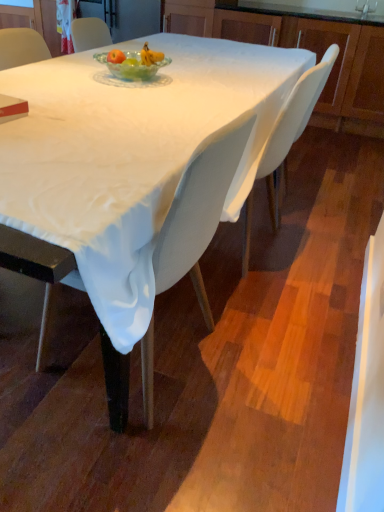
The image size is (384, 512). What are the coordinates of `silver metallic faucet at upper center` in the screenshot? It's located at (365, 8).

What do you see at coordinates (12, 108) in the screenshot?
I see `matte red book at lower left` at bounding box center [12, 108].

What do you see at coordinates (293, 123) in the screenshot? I see `white plastic chair at center, the first chair viewed from the back` at bounding box center [293, 123].

I want to click on translucent glass bowl at center, so click(132, 66).

Locate an element on the screen. The image size is (384, 512). white fabric chair at center, placed as the second chair when sorted from right to left is located at coordinates (197, 215).

You are a GUI agent. You are given a task and a screenshot of the screen. Output one action in this format:
    pyautogui.click(x=<x>, y=<y>)
    Task: Click on the silver metallic faucet at upper center
    This screenshot has height=512, width=384.
    Given the screenshot: What is the action you would take?
    point(365,8)

From the image's perspective, is silver metallic faucet at upper center positioned above or below white fabric table at center?

silver metallic faucet at upper center is above white fabric table at center.

Considering the sizes of objects silver metallic faucet at upper center and white fabric table at center in the image provided, who is smaller, silver metallic faucet at upper center or white fabric table at center?

With smaller size is silver metallic faucet at upper center.

Is silver metallic faucet at upper center next to white fabric table at center?

No, silver metallic faucet at upper center is not beside white fabric table at center.

From a real-world perspective, is silver metallic faucet at upper center beneath white fabric table at center?

Incorrect, from a real-world perspective, silver metallic faucet at upper center is higher than white fabric table at center.

Is translucent glass bowl at center facing away from white plastic chair at center, the second chair when ordered from front to back?

translucent glass bowl at center is not turned away from white plastic chair at center, the second chair when ordered from front to back.

Could you measure the distance between translucent glass bowl at center and white plastic chair at center, the second chair when ordered from front to back?

The distance of translucent glass bowl at center from white plastic chair at center, the second chair when ordered from front to back, is 26.22 inches.

Does translucent glass bowl at center lie in front of white plastic chair at center, which ranks as the second chair in left-to-right order?

Yes, translucent glass bowl at center is in front of white plastic chair at center, which ranks as the second chair in left-to-right order.

Can you confirm if translucent glass bowl at center is thinner than white plastic chair at center, which ranks as the second chair in left-to-right order?

Indeed, translucent glass bowl at center has a lesser width compared to white plastic chair at center, which ranks as the second chair in left-to-right order.

Is silver metallic faucet at upper center positioned far away from white plastic chair at center, the second chair when ordered from front to back?

Yes.

Can you tell me how much silver metallic faucet at upper center and white plastic chair at center, the first chair viewed from the back, differ in facing direction?

The angle between the facing direction of silver metallic faucet at upper center and the facing direction of white plastic chair at center, the first chair viewed from the back, is 82.1 degrees.

From the image's perspective, which is above, silver metallic faucet at upper center or white plastic chair at center, which ranks as the second chair in left-to-right order?

silver metallic faucet at upper center.

Between silver metallic faucet at upper center and white plastic chair at center, the first chair viewed from the back, which one has less height?

With less height is silver metallic faucet at upper center.

From a real-world perspective, which is physically below, white fabric table at center or white fabric chair at center, which is the 2th chair in back-to-front order?

In real-world perspective, white fabric chair at center, which is the 2th chair in back-to-front order, is lower.

Is white fabric table at center wider than white fabric chair at center, the 1th chair viewed from the left?

Correct, the width of white fabric table at center exceeds that of white fabric chair at center, the 1th chair viewed from the left.

Considering the sizes of objects white fabric table at center and white fabric chair at center, placed as the second chair when sorted from right to left, in the image provided, who is bigger, white fabric table at center or white fabric chair at center, placed as the second chair when sorted from right to left,?

white fabric table at center is bigger.

Is white fabric table at center not close to white fabric chair at center, the 1th chair viewed from the left?

No.

Is matte wood cabinet at upper right not inside matte red book at lower left?

matte wood cabinet at upper right is positioned outside matte red book at lower left.

Is matte wood cabinet at upper right smaller than matte red book at lower left?

Actually, matte wood cabinet at upper right might be larger than matte red book at lower left.

Locate an element on the screen. cabinetry that is behind the matte red book at lower left is located at coordinates (305, 48).

From the image's perspective, is matte wood cabinet at upper right located above or below matte red book at lower left?

Based on their image positions, matte wood cabinet at upper right is located above matte red book at lower left.

Which point is more distant from viewer, (9,104) or (131,312)?

Point (9,104)

Looking at this image, does matte red book at lower left have a greater width compared to white fabric table at center?

Incorrect, the width of matte red book at lower left does not surpass that of white fabric table at center.

From the image's perspective, is matte red book at lower left below white fabric table at center?

Indeed, from the image's perspective, matte red book at lower left is shown beneath white fabric table at center.

Is matte red book at lower left located within translucent glass bowl at center?

No, translucent glass bowl at center does not contain matte red book at lower left.

Are translucent glass bowl at center and matte red book at lower left located far from each other?

No, translucent glass bowl at center is not far from matte red book at lower left.

I want to click on bowl behind the matte red book at lower left, so click(x=132, y=66).

From the picture: From a real-world perspective, is translucent glass bowl at center physically located above or below matte red book at lower left?

In terms of real-world spatial position, translucent glass bowl at center is above matte red book at lower left.

Image resolution: width=384 pixels, height=512 pixels. Find the location of `faucet located above the white fabric table at center (from a real-world perspective)`. faucet located above the white fabric table at center (from a real-world perspective) is located at coordinates (365, 8).

What are the coordinates of `bowl on the left of white plastic chair at center, the second chair when ordered from front to back` in the screenshot? It's located at (132, 66).

Based on their spatial positions, is silver metallic faucet at upper center or matte wood cabinet at upper right closer to white fabric chair at center, placed as the second chair when sorted from right to left?

matte wood cabinet at upper right lies closer to white fabric chair at center, placed as the second chair when sorted from right to left, than the other object.

Based on their spatial positions, is silver metallic faucet at upper center or white fabric chair at center, which is the 2th chair in back-to-front order, closer to white fabric table at center?

The object closer to white fabric table at center is white fabric chair at center, which is the 2th chair in back-to-front order.

From the image, which object appears to be nearer to white fabric chair at center, placed as the second chair when sorted from right to left, translucent glass bowl at center or matte red book at lower left?

The object closer to white fabric chair at center, placed as the second chair when sorted from right to left, is matte red book at lower left.

Based on their spatial positions, is silver metallic faucet at upper center or translucent glass bowl at center closer to white fabric chair at center, which is the first chair from front to back?

translucent glass bowl at center is positioned closer to the anchor white fabric chair at center, which is the first chair from front to back.

When comparing their distances from white plastic chair at center, the first chair viewed from the back, does white fabric table at center or translucent glass bowl at center seem further?

Among the two, translucent glass bowl at center is located further to white plastic chair at center, the first chair viewed from the back.

From the image, which object appears to be nearer to white fabric chair at center, which is the 2th chair in back-to-front order, matte red book at lower left or silver metallic faucet at upper center?

matte red book at lower left lies closer to white fabric chair at center, which is the 2th chair in back-to-front order, than the other object.

Looking at the image, which one is located further to translucent glass bowl at center, white fabric table at center or silver metallic faucet at upper center?

silver metallic faucet at upper center.

Looking at the image, which one is located closer to silver metallic faucet at upper center, matte wood cabinet at upper right or translucent glass bowl at center?

Based on the image, matte wood cabinet at upper right appears to be nearer to silver metallic faucet at upper center.

Find the location of a particular element. Image resolution: width=384 pixels, height=512 pixels. bowl between white fabric table at center and white plastic chair at center, which is the first chair in right-to-left order, from front to back is located at coordinates (132, 66).

Where is `book between white fabric chair at center, the 1th chair viewed from the left, and translucent glass bowl at center from front to back`? The image size is (384, 512). book between white fabric chair at center, the 1th chair viewed from the left, and translucent glass bowl at center from front to back is located at coordinates (12, 108).

Locate an element on the screen. The image size is (384, 512). chair between white fabric table at center and translucent glass bowl at center from front to back is located at coordinates (197, 215).

In order to click on book between white fabric chair at center, placed as the second chair when sorted from right to left, and silver metallic faucet at upper center from front to back in this screenshot , I will do `click(12, 108)`.